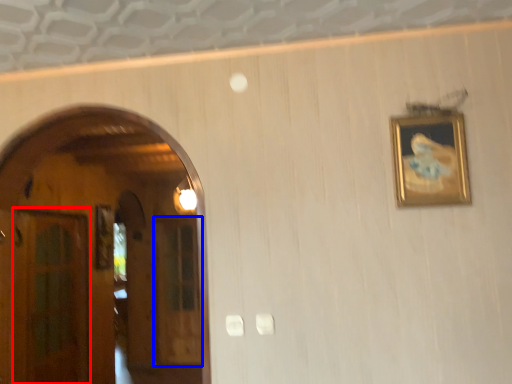
Question: Which of the following is the farthest to the observer, glass door (highlighted by a red box) or glass door (highlighted by a blue box)?

Choices:
 (A) glass door
 (B) glass door

Answer: (B)